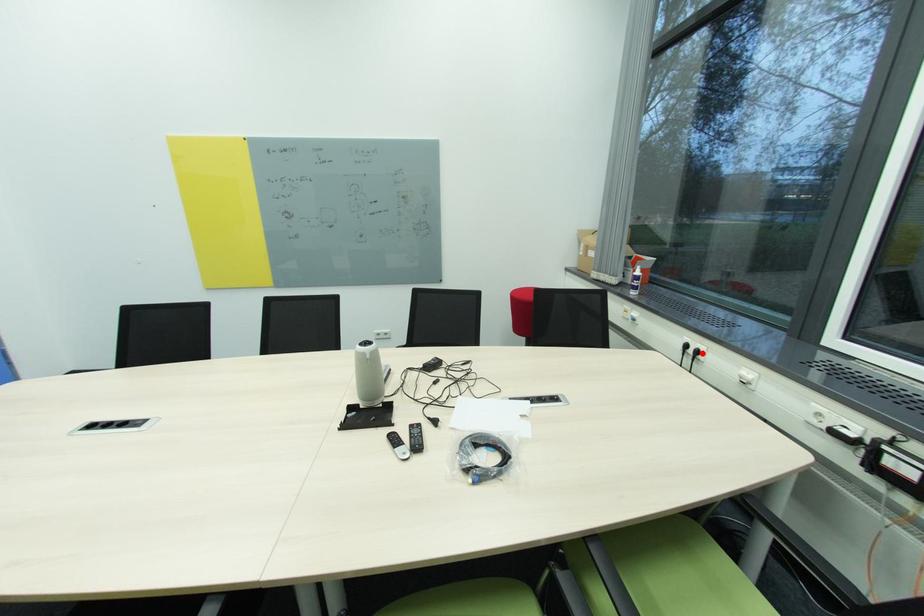
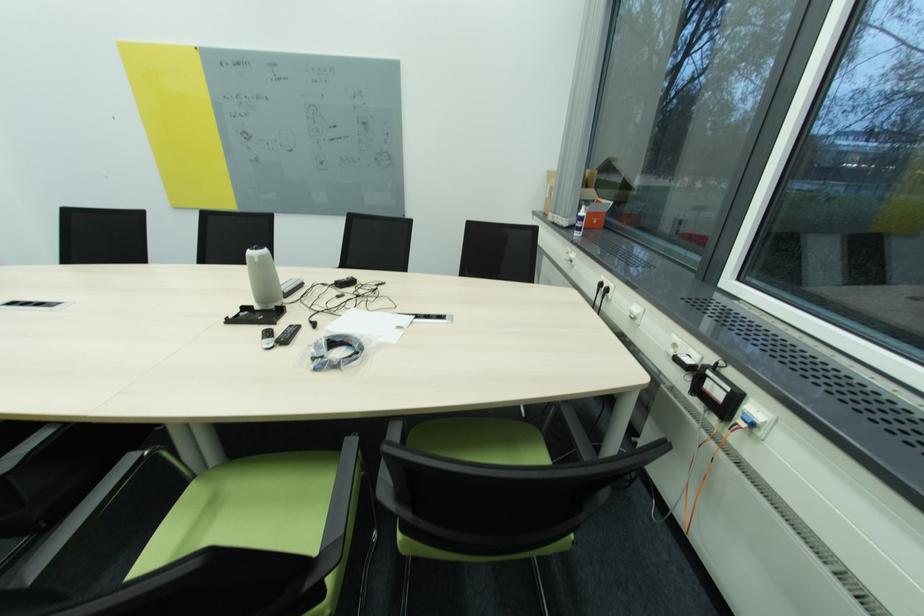
The point at the highlighted location is marked in the first image. Where is the corresponding point in the second image?

(612, 291)